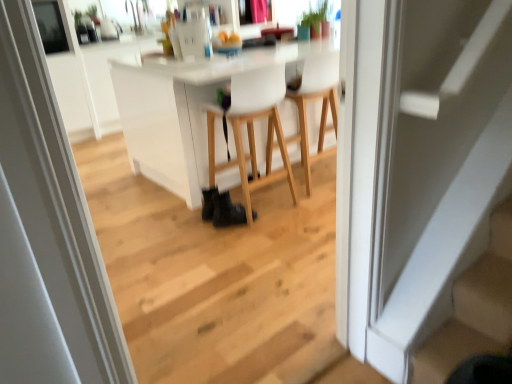
Question: In which direction should I rotate to look at white matte chair at center, placed as the first chair when sorted from right to left?

Choices:
 (A) right
 (B) left

Answer: (A)

Question: Is white glossy door at center at the back of white matte stair at lower right?

Choices:
 (A) no
 (B) yes

Answer: (A)

Question: From a real-world perspective, is white matte stair at lower right beneath white glossy door at center?

Choices:
 (A) no
 (B) yes

Answer: (B)

Question: Does white matte stair at lower right have a greater height compared to white glossy door at center?

Choices:
 (A) no
 (B) yes

Answer: (A)

Question: Can you confirm if white matte stair at lower right is thinner than white glossy door at center?

Choices:
 (A) yes
 (B) no

Answer: (B)

Question: Does white matte stair at lower right appear on the left side of white glossy door at center?

Choices:
 (A) yes
 (B) no

Answer: (B)

Question: Is white matte stair at lower right closer to camera compared to white glossy door at center?

Choices:
 (A) yes
 (B) no

Answer: (B)

Question: Is white matte chair at center, placed as the first chair when sorted from right to left, at the right side of black leather shoe at lower center?

Choices:
 (A) no
 (B) yes

Answer: (B)

Question: Are white matte chair at center, acting as the second chair starting from the left, and black leather shoe at lower center far apart?

Choices:
 (A) no
 (B) yes

Answer: (A)

Question: From a real-world perspective, is white matte chair at center, acting as the second chair starting from the left, beneath black leather shoe at lower center?

Choices:
 (A) no
 (B) yes

Answer: (A)

Question: Is white matte chair at center, acting as the second chair starting from the left, smaller than black leather shoe at lower center?

Choices:
 (A) yes
 (B) no

Answer: (B)

Question: Does white matte chair at center, acting as the second chair starting from the left, have a greater height compared to black leather shoe at lower center?

Choices:
 (A) no
 (B) yes

Answer: (B)

Question: From the image's perspective, would you say white matte chair at center, placed as the first chair when sorted from right to left, is positioned over black leather shoe at lower center?

Choices:
 (A) no
 (B) yes

Answer: (B)

Question: From a real-world perspective, is white glossy door at center beneath white matte chair at center, acting as the second chair starting from the left?

Choices:
 (A) no
 (B) yes

Answer: (A)